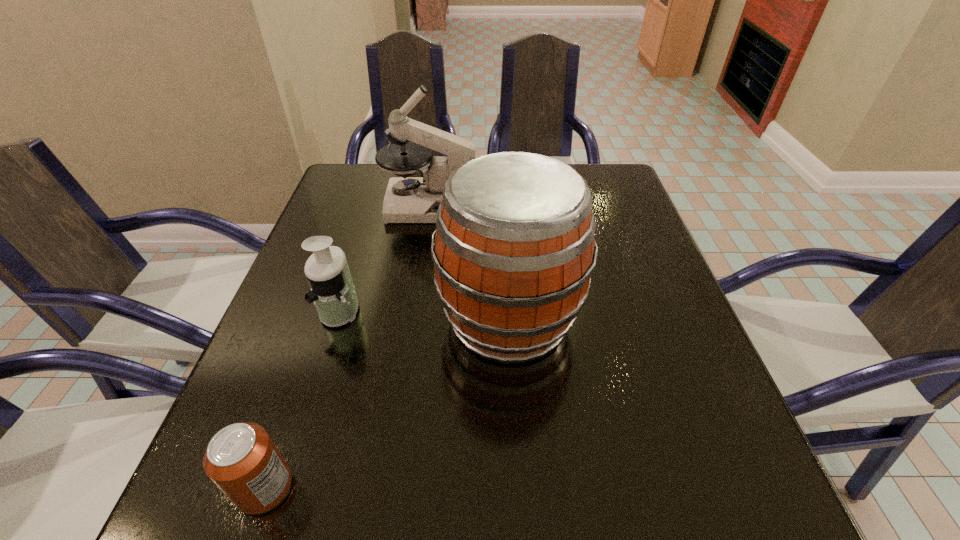
Identify the location of object that is at the near edge. (241, 459).

This screenshot has height=540, width=960. In order to click on microscope present at the left edge in this screenshot , I will do `click(407, 199)`.

In order to click on juicer positioned at the left edge in this screenshot , I will do `click(332, 290)`.

Image resolution: width=960 pixels, height=540 pixels. I want to click on can that is at the left edge, so click(241, 459).

You are a GUI agent. You are given a task and a screenshot of the screen. Output one action in this format:
    pyautogui.click(x=<x>, y=<y>)
    Task: Click on the object that is at the far left corner
    
    Given the screenshot: What is the action you would take?
    pyautogui.click(x=407, y=199)

What are the coordinates of `object that is positioned at the near left corner` in the screenshot? It's located at (241, 459).

Identify the location of free spot at the left edge of the desktop. This screenshot has width=960, height=540. (340, 232).

Locate an element on the screen. vacant region at the right edge is located at coordinates (646, 382).

In the image, there is a desktop. Where is `vacant area at the far left corner`? The width and height of the screenshot is (960, 540). vacant area at the far left corner is located at coordinates point(344,174).

In the image, there is a desktop. Where is `blank space at the far right corner`? The width and height of the screenshot is (960, 540). blank space at the far right corner is located at coordinates (625, 184).